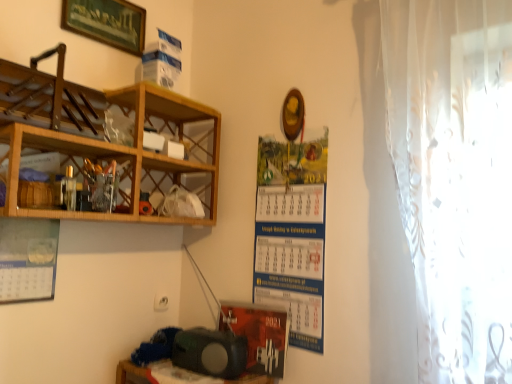
Question: From their relative heights in the image, would you say matte black speaker at lower center is taller or shorter than matte paper calendar at center?

Choices:
 (A) short
 (B) tall

Answer: (A)

Question: Is matte black speaker at lower center to the left or to the right of matte paper calendar at center in the image?

Choices:
 (A) right
 (B) left

Answer: (B)

Question: Which object is the closest to the matte black speaker at lower center?

Choices:
 (A) matte paper calendar at center
 (B) wooden at left, the 1th shelf ordered from the bottom
 (C) matte black speaker at lower center
 (D) wooden at left, placed as the second shelf when sorted from bottom to top
 (E) wooden framed picture at upper left

Answer: (C)

Question: Which of these objects is positioned farthest from the wooden framed picture at upper left?

Choices:
 (A) wooden at left, the first shelf in the top-to-bottom sequence
 (B) matte paper calendar at center
 (C) matte black speaker at lower center
 (D) matte black speaker at lower center
 (E) wooden at left, the 2th shelf positioned from the top

Answer: (D)